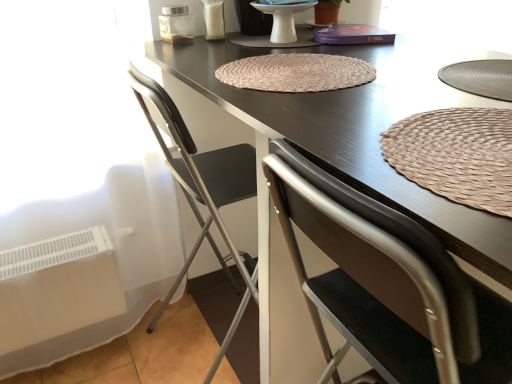
Locate an element on the screen. vacant area that is in front of brown woven mat at center, the second mat viewed from the front is located at coordinates (330, 109).